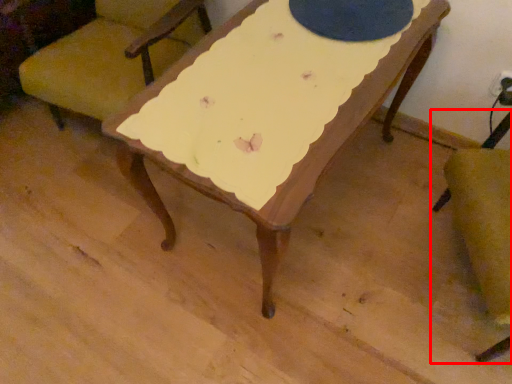
Question: From the image, what is the correct spatial relationship of chair (annotated by the red box) in relation to chair?

Choices:
 (A) right
 (B) left

Answer: (A)